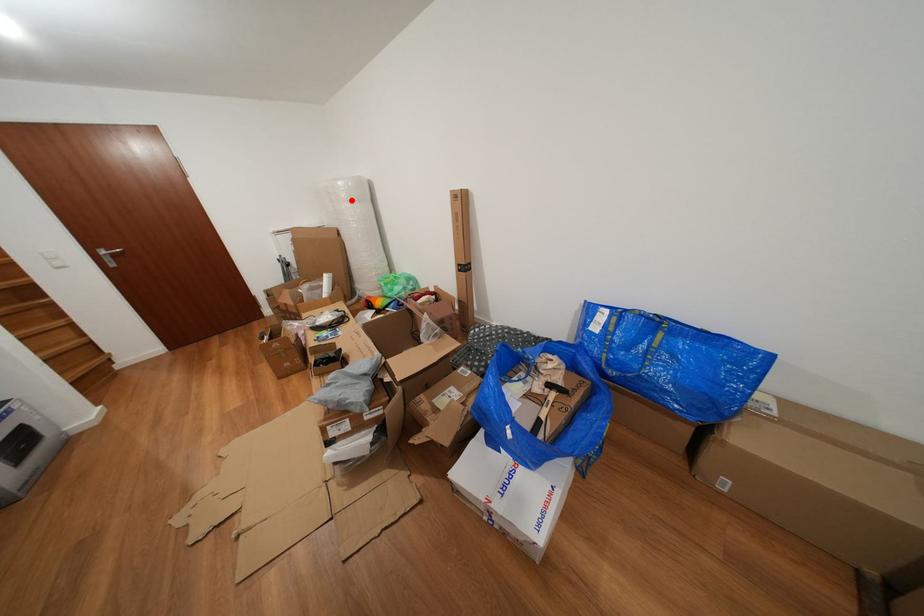
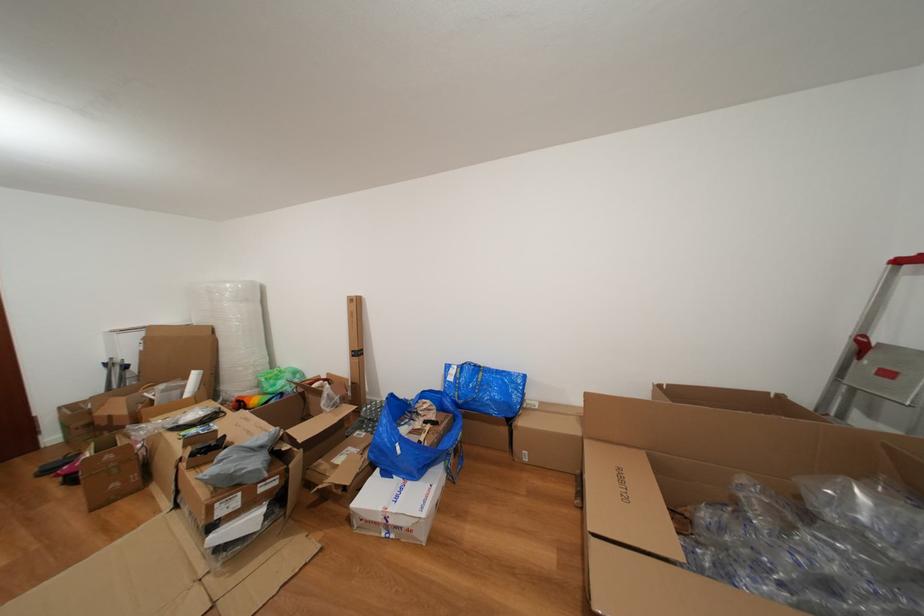
In the second image, find the point that corresponds to the highlighted location in the first image.

(237, 301)